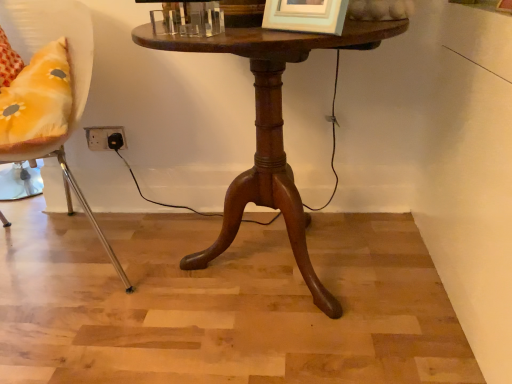
Measure the distance between point (x=280, y=142) and camera.

1.12 meters.

Describe the element at coordinates (271, 129) in the screenshot. I see `mahogany wood table at center` at that location.

Where is `mahogany wood table at center`? This screenshot has height=384, width=512. mahogany wood table at center is located at coordinates (271, 129).

Measure the distance between mahogany wood table at center and camera.

mahogany wood table at center and camera are 29.21 inches apart.

The height and width of the screenshot is (384, 512). I want to click on metallic yellow cushion at left, so click(48, 87).

What do you see at coordinates (48, 87) in the screenshot? Image resolution: width=512 pixels, height=384 pixels. I see `metallic yellow cushion at left` at bounding box center [48, 87].

Where is `mahogany wood table at center`? This screenshot has height=384, width=512. mahogany wood table at center is located at coordinates (271, 129).

Consider the image. Between metallic yellow cushion at left and mahogany wood table at center, which one appears on the right side from the viewer's perspective?

mahogany wood table at center is more to the right.

Which object is more forward, metallic yellow cushion at left or mahogany wood table at center?

Positioned in front is metallic yellow cushion at left.

Does point (28, 7) lie in front of point (265, 123)?

No.

From the image's perspective, who appears lower, metallic yellow cushion at left or mahogany wood table at center?

mahogany wood table at center appears lower in the image.

From a real-world perspective, between metallic yellow cushion at left and mahogany wood table at center, who is vertically higher?

metallic yellow cushion at left is physically above.

Considering the sizes of objects metallic yellow cushion at left and mahogany wood table at center in the image provided, who is wider, metallic yellow cushion at left or mahogany wood table at center?

With larger width is metallic yellow cushion at left.

Considering the relative sizes of metallic yellow cushion at left and mahogany wood table at center in the image provided, is metallic yellow cushion at left taller than mahogany wood table at center?

Yes.

Between metallic yellow cushion at left and mahogany wood table at center, which one has smaller size?

mahogany wood table at center.

Is metallic yellow cushion at left not inside mahogany wood table at center?

Absolutely, metallic yellow cushion at left is external to mahogany wood table at center.

Is metallic yellow cushion at left next to mahogany wood table at center and touching it?

No, metallic yellow cushion at left is not next to mahogany wood table at center.

Is metallic yellow cushion at left positioned with its back to mahogany wood table at center?

No, metallic yellow cushion at left is not facing away from mahogany wood table at center.

This screenshot has height=384, width=512. I want to click on chair above the mahogany wood table at center (from the image's perspective), so click(x=48, y=87).

Considering the positions of objects mahogany wood table at center and metallic yellow cushion at left in the image provided, who is more to the left, mahogany wood table at center or metallic yellow cushion at left?

From the viewer's perspective, metallic yellow cushion at left appears more on the left side.

Between mahogany wood table at center and metallic yellow cushion at left, which one is positioned behind?

mahogany wood table at center is more distant.

Which is closer, (x=258, y=77) or (x=18, y=124)?

Positioned in front is point (x=18, y=124).

Looking at this image, from the image's perspective, is mahogany wood table at center above or below metallic yellow cushion at left?

mahogany wood table at center is situated lower than metallic yellow cushion at left in the image.

In the scene shown: From a real-world perspective, who is located lower, mahogany wood table at center or metallic yellow cushion at left?

From a 3D spatial view, mahogany wood table at center is below.

Considering the sizes of objects mahogany wood table at center and metallic yellow cushion at left in the image provided, who is thinner, mahogany wood table at center or metallic yellow cushion at left?

Thinner between the two is mahogany wood table at center.

Can you confirm if mahogany wood table at center is shorter than metallic yellow cushion at left?

Yes, mahogany wood table at center is shorter than metallic yellow cushion at left.

Is mahogany wood table at center bigger than metallic yellow cushion at left?

No.

Is mahogany wood table at center inside or outside of metallic yellow cushion at left?

mahogany wood table at center is spatially situated outside metallic yellow cushion at left.

Is mahogany wood table at center far away from metallic yellow cushion at left?

No, mahogany wood table at center is in close proximity to metallic yellow cushion at left.

Is mahogany wood table at center facing away from metallic yellow cushion at left?

That's not correct — mahogany wood table at center is not looking away from metallic yellow cushion at left.

In the image, there is a mahogany wood table at center. Identify the location of chair above it (from the image's perspective). (48, 87).

I want to click on table on the right of metallic yellow cushion at left, so click(271, 129).

This screenshot has height=384, width=512. Identify the location of table below the metallic yellow cushion at left (from a real-world perspective). [271, 129].